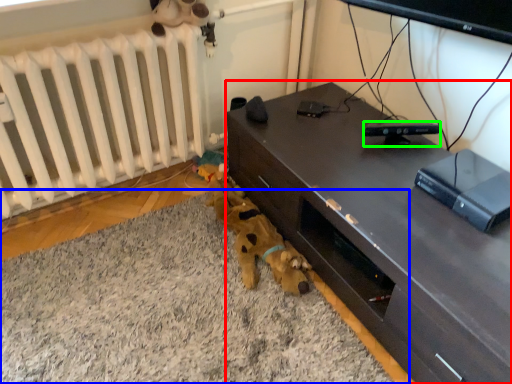
Question: Estimate the real-world distances between objects in this image. Which object is closer to desk (highlighted by a red box), plain (highlighted by a blue box) or gadget (highlighted by a green box)?

Choices:
 (A) plain
 (B) gadget

Answer: (B)